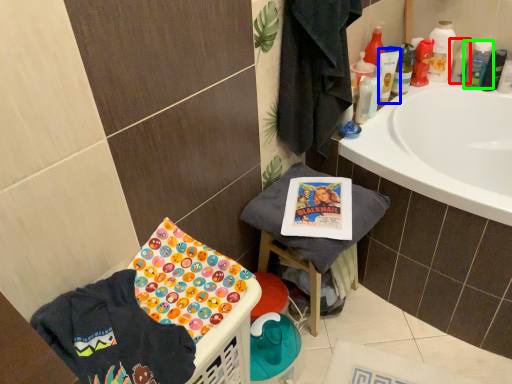
Question: Which object is positioned farthest from cleaning product (highlighted by a red box)? Select from mouthwash (highlighted by a blue box) and mouthwash (highlighted by a green box).

Choices:
 (A) mouthwash
 (B) mouthwash

Answer: (A)